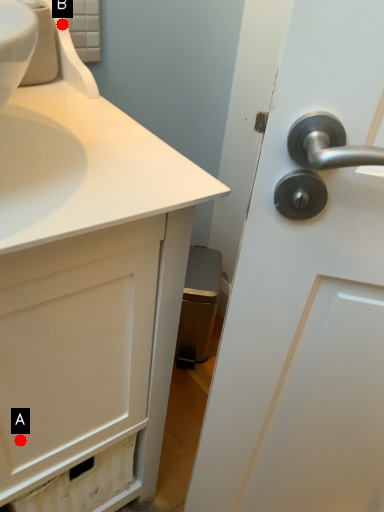
Question: Two points are circled on the image, labeled by A and B beside each circle. Which point appears closest to the camera in this image?

Choices:
 (A) A is closer
 (B) B is closer

Answer: (A)